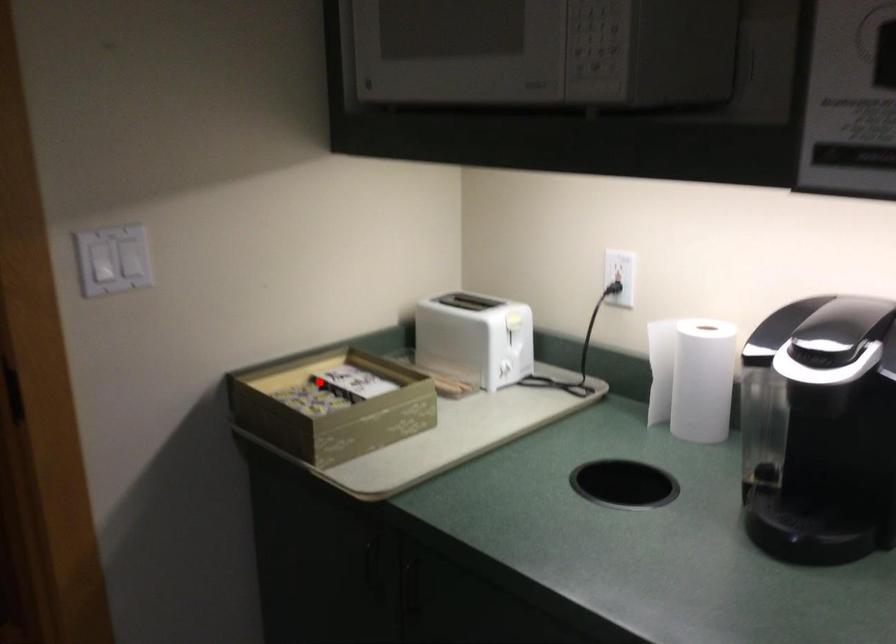
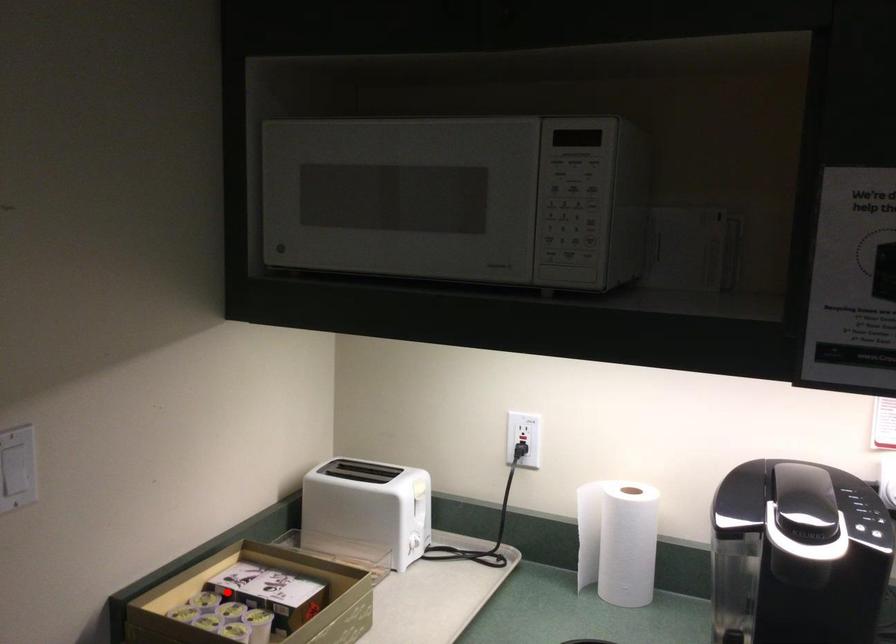
I am providing you with two images of the same scene from different viewpoints. A red point is marked on the first image and another point is marked on the second image. Is the marked point in image1 the same physical position as the marked point in image2?

Yes